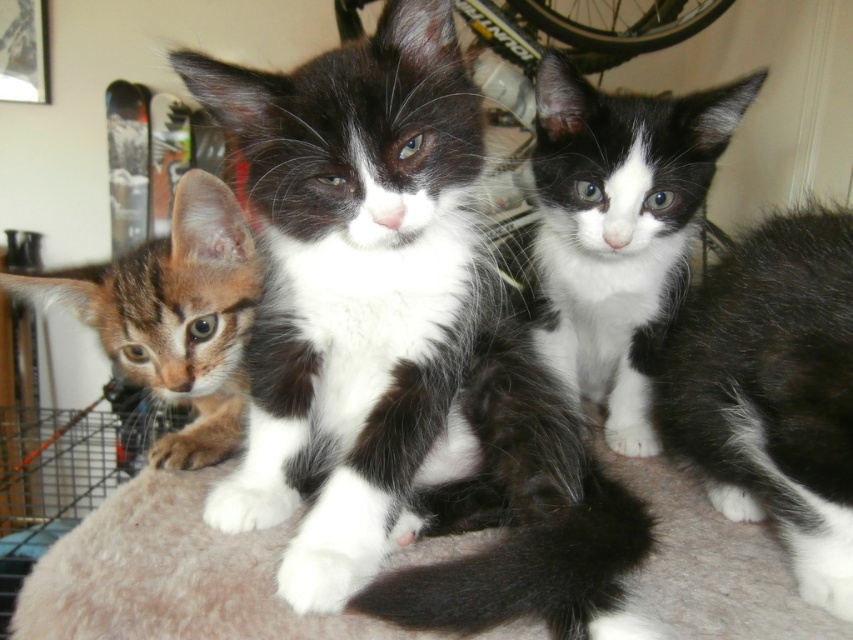
You are standing in the living room and see the black and white fur cat at center. Can you determine its exact position based on the coordinate system where the bottom left corner is the origin?

The black and white fur cat at center is located at point coordinates of (403, 355).

You are a photographer trying to capture a photo of the kittens. You need to ensure that the black and white fur cat at center and the white soft fur kitten at center are both in focus. Which kitten should you focus on first if you want to start from the left side?

The black and white fur cat at center should be focused on first since it is positioned on the left side of the white soft fur kitten at center.

You are a cat owner who wants to buy a new bed for your two kittens. The bed you found has a maximum capacity of 2 kilograms. You know the tabby fur kitten at left weighs 1.5 kilograms. Can the black and white fur cat at center also fit into the bed?

The black and white fur cat at center is larger in width than the tabby fur kitten at left, which weighs 1.5 kilograms. Since the bed can hold up to 2 kilograms, the black and white fur cat at center may exceed the weight limit and might not fit comfortably.